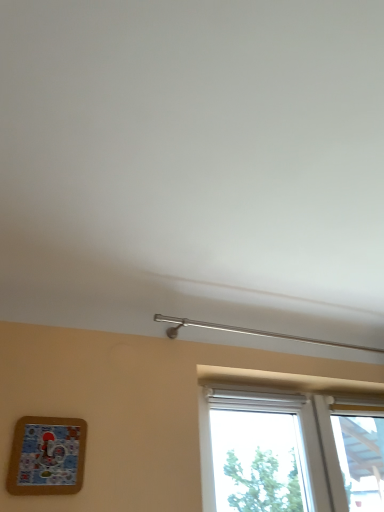
Question: Is the position of corkboard at lower left more distant than that of white plastic window at lower right?

Choices:
 (A) yes
 (B) no

Answer: (B)

Question: From a real-world perspective, is corkboard at lower left on top of white plastic window at lower right?

Choices:
 (A) no
 (B) yes

Answer: (A)

Question: From the image's perspective, is corkboard at lower left under white plastic window at lower right?

Choices:
 (A) no
 (B) yes

Answer: (A)

Question: Considering the relative sizes of corkboard at lower left and white plastic window at lower right in the image provided, is corkboard at lower left thinner than white plastic window at lower right?

Choices:
 (A) yes
 (B) no

Answer: (A)

Question: Is corkboard at lower left located outside white plastic window at lower right?

Choices:
 (A) no
 (B) yes

Answer: (B)

Question: Is corkboard at lower left oriented away from white plastic window at lower right?

Choices:
 (A) yes
 (B) no

Answer: (B)

Question: Is white plastic window at lower right facing towards corkboard at lower left?

Choices:
 (A) no
 (B) yes

Answer: (A)

Question: Is white plastic window at lower right not close to corkboard at lower left?

Choices:
 (A) no
 (B) yes

Answer: (B)

Question: Considering the relative positions of white plastic window at lower right and corkboard at lower left in the image provided, is white plastic window at lower right in front of corkboard at lower left?

Choices:
 (A) yes
 (B) no

Answer: (B)

Question: Does white plastic window at lower right appear on the left side of corkboard at lower left?

Choices:
 (A) yes
 (B) no

Answer: (B)

Question: Is white plastic window at lower right positioned behind corkboard at lower left?

Choices:
 (A) yes
 (B) no

Answer: (A)

Question: From the image's perspective, is white plastic window at lower right beneath corkboard at lower left?

Choices:
 (A) no
 (B) yes

Answer: (B)

Question: Is corkboard at lower left bigger or smaller than white plastic window at lower right?

Choices:
 (A) big
 (B) small

Answer: (B)